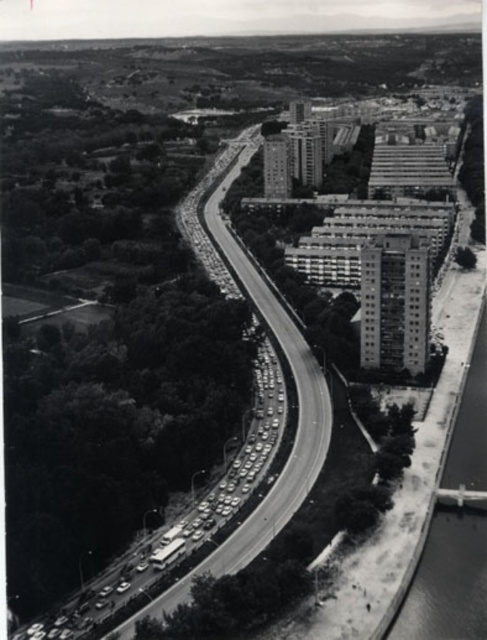
Is smooth asphalt highway at lower left to the left of smooth concrete river at right from the viewer's perspective?

Correct, you'll find smooth asphalt highway at lower left to the left of smooth concrete river at right.

Between smooth asphalt highway at lower left and smooth concrete river at right, which one is positioned lower?

smooth concrete river at right is lower down.

The width and height of the screenshot is (487, 640). In order to click on smooth asphalt highway at lower left in this screenshot , I will do `click(274, 483)`.